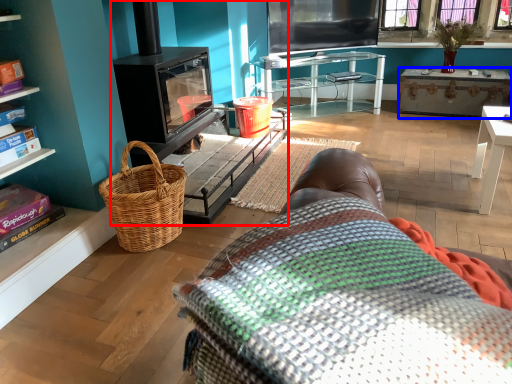
Question: Which object appears closest to the camera in this image, fireplace (highlighted by a red box) or desk (highlighted by a blue box)?

Choices:
 (A) fireplace
 (B) desk

Answer: (A)